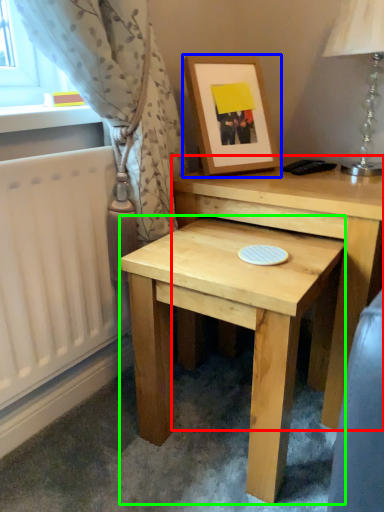
Question: Based on their relative distances, which object is farther from table (highlighted by a red box)? Choose from picture frame (highlighted by a blue box) and table (highlighted by a green box).

Choices:
 (A) picture frame
 (B) table

Answer: (A)